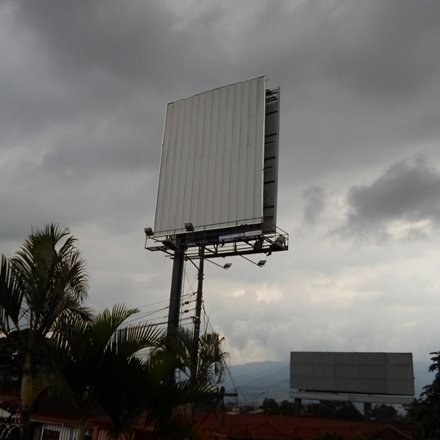
Where is `wires`? Image resolution: width=440 pixels, height=440 pixels. wires is located at coordinates (184, 316).